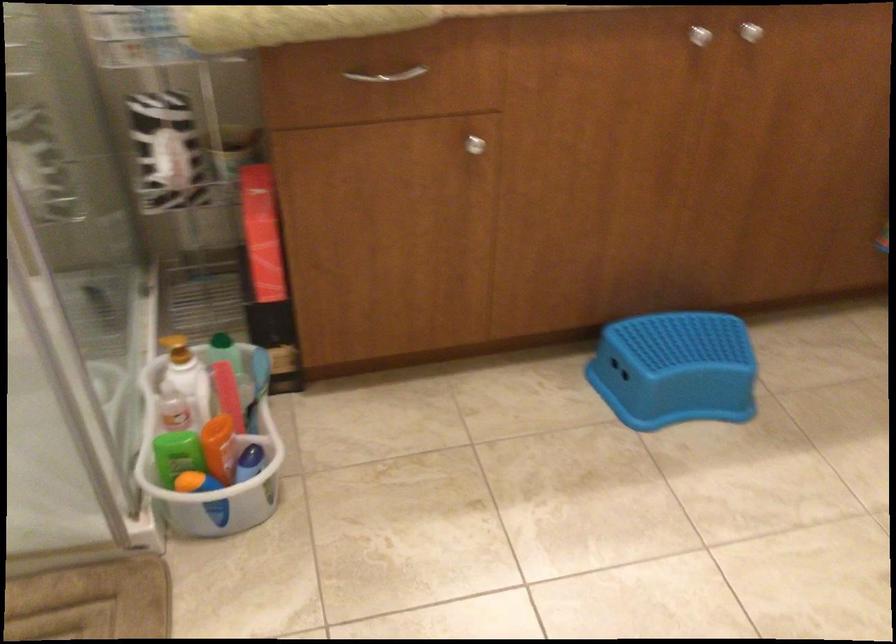
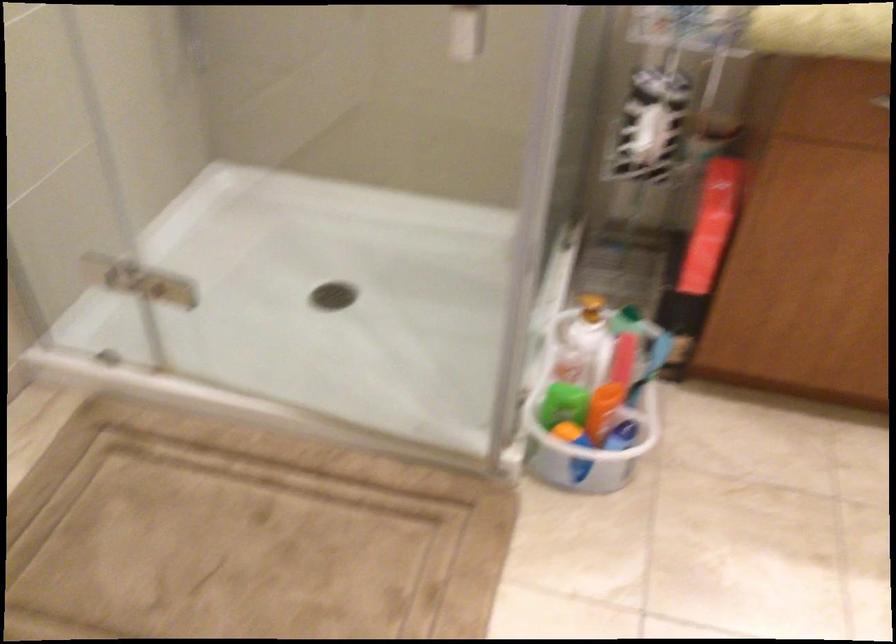
In the second image, find the point that corresponds to the point at 177,460 in the first image.

(563, 402)